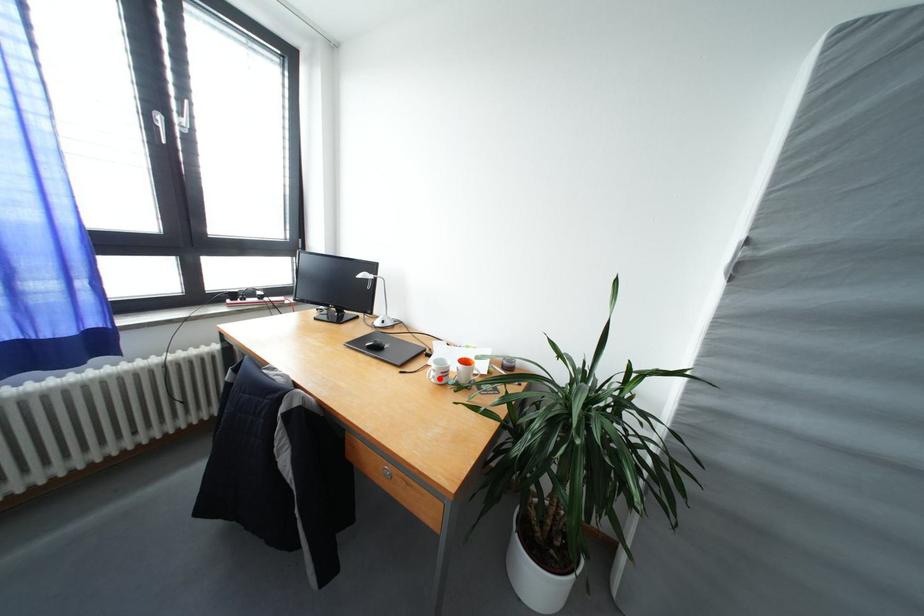
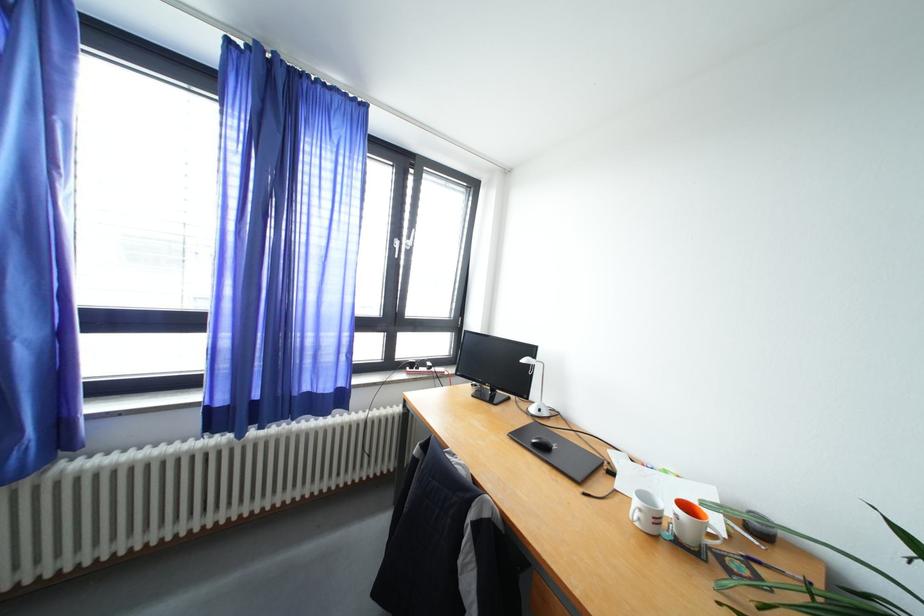
Locate, in the second image, the point that corresponds to the highlighted location in the first image.

(645, 519)